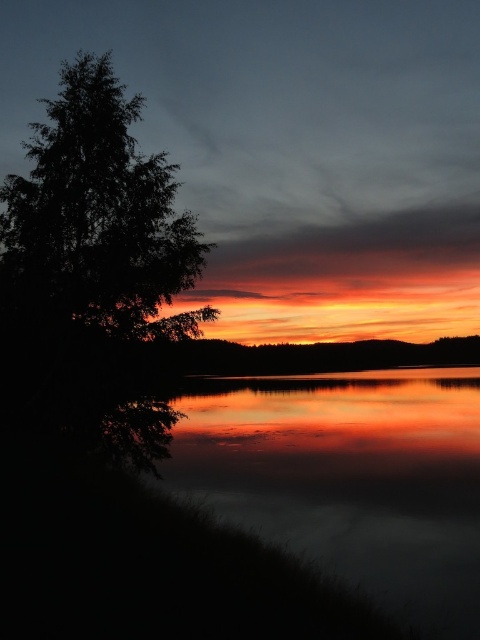
You are a photographer standing at the edge of the water in the scene. You want to capture a photo that includes both the reflective glass water at lower left and the dark green leafy tree at left. Given that your camera has a maximum zoom range of 100 feet, can you fit both objects into the same frame without moving your position?

The reflective glass water at lower left and dark green leafy tree at left are 41.38 feet apart from each other. Since your camera can zoom up to 100 feet, which is greater than the distance between the two objects, you can fit both into the same frame without moving.

You are standing at the point marked as point (347,477) in the lower left of the image. Looking towards the tree silhouette on the left, what surface are you standing on?

You are standing on reflective glass water at lower left.